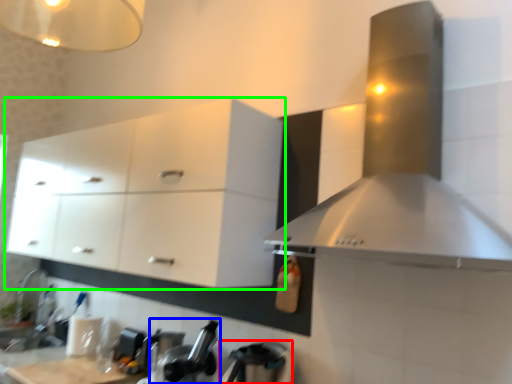
Question: Which object is positioned farthest from appliance (highlighted by a red box)? Select from appliance (highlighted by a blue box) and cabinetry (highlighted by a green box).

Choices:
 (A) appliance
 (B) cabinetry

Answer: (B)